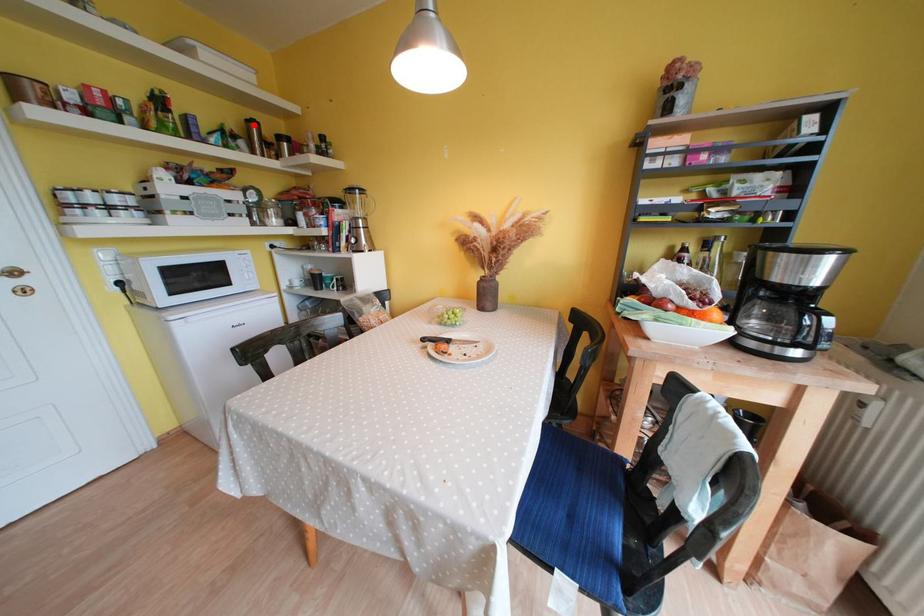
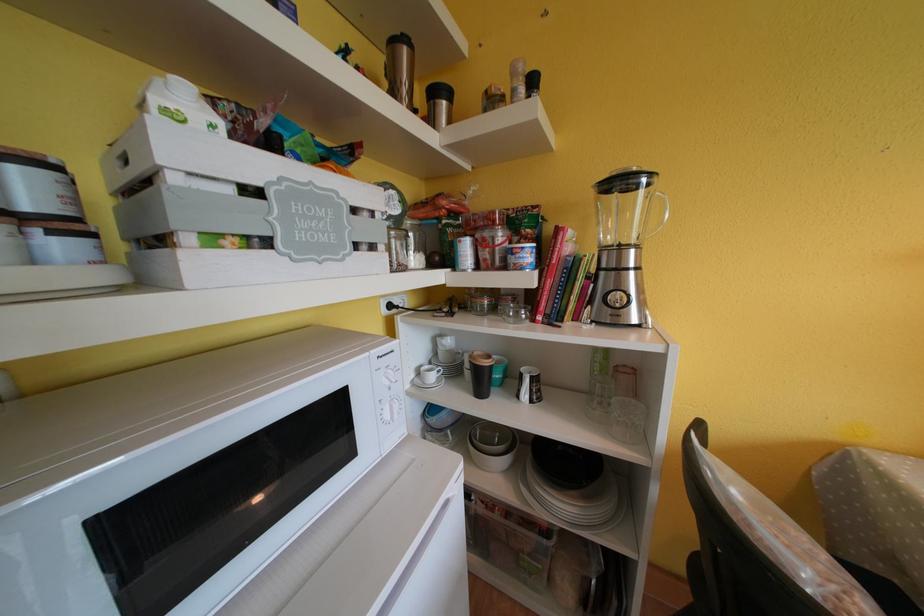
Where in the second image is the point corresponding to the highlighted location from the first image?

(399, 46)